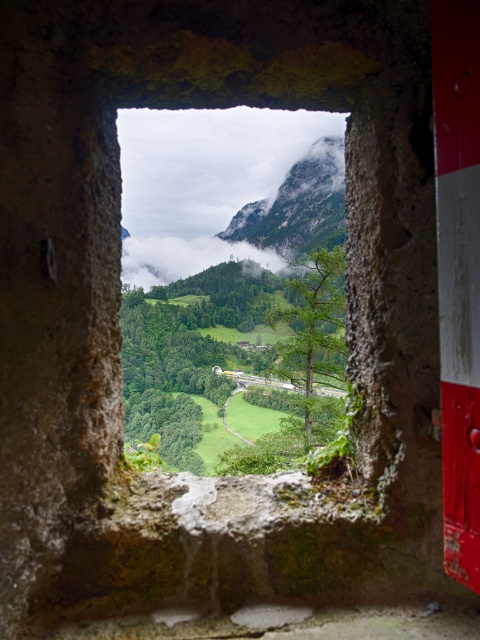
Question: Which of the following is the farthest from the observer?

Choices:
 (A) (268, 200)
 (B) (204, 134)

Answer: (B)

Question: Does transparent glass window at center appear on the right side of green grassy mountain at center?

Choices:
 (A) yes
 (B) no

Answer: (B)

Question: Where is transparent glass window at center located in relation to green grassy mountain at center in the image?

Choices:
 (A) left
 (B) right

Answer: (A)

Question: Does transparent glass window at center have a smaller size compared to green grassy mountain at center?

Choices:
 (A) yes
 (B) no

Answer: (B)

Question: Which point is farther from the camera taking this photo?

Choices:
 (A) (312, 152)
 (B) (178, 205)

Answer: (B)